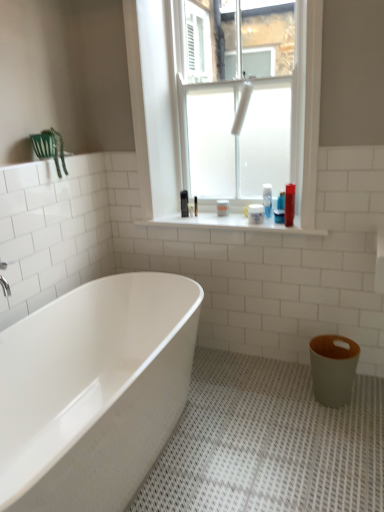
Question: Can you confirm if matte plastic bottle at upper right, which is counted as the first toiletry, starting from the front, is bigger than translucent plastic container at center, which appears as the first toiletry when viewed from the back?

Choices:
 (A) yes
 (B) no

Answer: (A)

Question: From a real-world perspective, is matte plastic bottle at upper right, the 4th toiletry viewed from the left, physically above translucent plastic container at center, which appears as the first toiletry when viewed from the back?

Choices:
 (A) yes
 (B) no

Answer: (A)

Question: Is matte plastic bottle at upper right, which is counted as the first toiletry, starting from the front, turned away from translucent plastic container at center, the fourth toiletry when ordered from front to back?

Choices:
 (A) yes
 (B) no

Answer: (B)

Question: Is matte plastic bottle at upper right, which is counted as the first toiletry, starting from the front, positioned before translucent plastic container at center, the fourth toiletry when ordered from front to back?

Choices:
 (A) no
 (B) yes

Answer: (B)

Question: Could translucent plastic container at center, the fourth toiletry when ordered from front to back, be considered to be inside matte plastic bottle at upper right, which is counted as the first toiletry, starting from the front?

Choices:
 (A) no
 (B) yes

Answer: (A)

Question: From the image's perspective, relative to white matte container at upper center, which is counted as the 3th toiletry, starting from the right, is matte gray toilet bowl at lower right above or below?

Choices:
 (A) below
 (B) above

Answer: (A)

Question: Considering the positions of point (327, 353) and point (258, 207), is point (327, 353) closer or farther from the camera than point (258, 207)?

Choices:
 (A) closer
 (B) farther

Answer: (A)

Question: From their relative heights in the image, would you say matte gray toilet bowl at lower right is taller or shorter than white matte container at upper center, arranged as the third toiletry when viewed from the back?

Choices:
 (A) short
 (B) tall

Answer: (B)

Question: Is matte gray toilet bowl at lower right inside or outside of white matte container at upper center, which ranks as the 2th toiletry in left-to-right order?

Choices:
 (A) inside
 (B) outside

Answer: (B)

Question: From a real-world perspective, is matte gray toilet bowl at lower right above or below translucent plastic bottle at upper center, positioned as the third toiletry in left-to-right order?

Choices:
 (A) above
 (B) below

Answer: (B)

Question: In the image, is matte gray toilet bowl at lower right on the left side or the right side of translucent plastic bottle at upper center, marked as the second toiletry in a right-to-left arrangement?

Choices:
 (A) right
 (B) left

Answer: (A)

Question: Considering the positions of matte gray toilet bowl at lower right and translucent plastic bottle at upper center, marked as the second toiletry in a right-to-left arrangement, in the image, is matte gray toilet bowl at lower right taller or shorter than translucent plastic bottle at upper center, marked as the second toiletry in a right-to-left arrangement,?

Choices:
 (A) short
 (B) tall

Answer: (B)

Question: Looking at their shapes, would you say matte gray toilet bowl at lower right is wider or thinner than translucent plastic bottle at upper center, acting as the 3th toiletry starting from the front?

Choices:
 (A) wide
 (B) thin

Answer: (A)

Question: Is point (155, 134) positioned closer to the camera than point (288, 222)?

Choices:
 (A) farther
 (B) closer

Answer: (A)

Question: From a real-world perspective, is frosted glass window at upper center above or below matte plastic bottle at upper right, marked as the fourth toiletry in a back-to-front arrangement?

Choices:
 (A) above
 (B) below

Answer: (A)